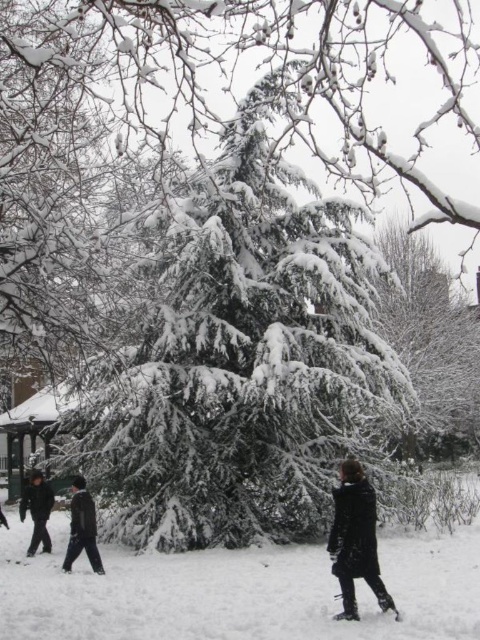
Does snow-covered evergreen at center have a larger size compared to dark gray coat at lower left?

Indeed, snow-covered evergreen at center has a larger size compared to dark gray coat at lower left.

Identify the location of snow-covered evergreen at center. (432, 349).

Where is `snow-covered evergreen at center`? This screenshot has width=480, height=640. snow-covered evergreen at center is located at coordinates (432, 349).

Can you confirm if black matte coat at lower right is thinner than dark brown leather jacket at lower left?

Yes, black matte coat at lower right is thinner than dark brown leather jacket at lower left.

Can you confirm if black matte coat at lower right is positioned below dark brown leather jacket at lower left?

Incorrect, black matte coat at lower right is not positioned below dark brown leather jacket at lower left.

The height and width of the screenshot is (640, 480). Describe the element at coordinates (355, 540) in the screenshot. I see `black matte coat at lower right` at that location.

What are the coordinates of `black matte coat at lower right` in the screenshot? It's located at (355, 540).

Between green textured pine tree at center and black matte jacket at lower left, which one appears on the left side from the viewer's perspective?

black matte jacket at lower left

Who is shorter, green textured pine tree at center or black matte jacket at lower left?

black matte jacket at lower left

Find the location of a particular element. Image resolution: width=480 pixels, height=640 pixels. green textured pine tree at center is located at coordinates (242, 365).